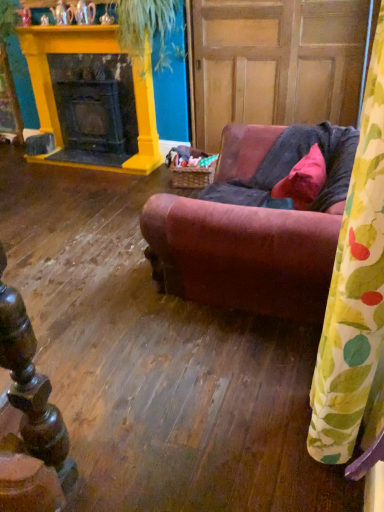
This screenshot has width=384, height=512. I want to click on blank space situated above yellow painted wood fireplace at upper left (from a real-world perspective), so click(x=76, y=32).